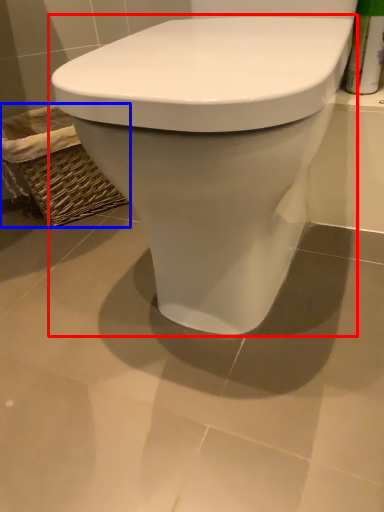
Question: Which object is further to the camera taking this photo, toilet (highlighted by a red box) or basket (highlighted by a blue box)?

Choices:
 (A) toilet
 (B) basket

Answer: (B)